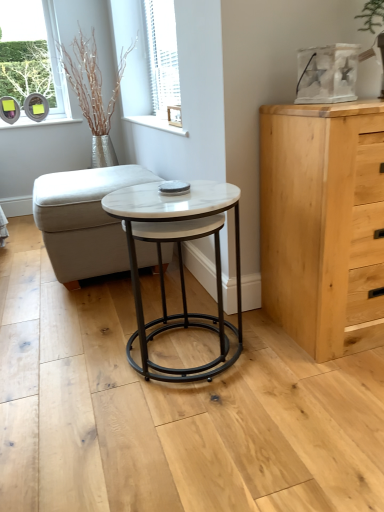
Where is `free space in front of light wood chest of drawers at right`? free space in front of light wood chest of drawers at right is located at coordinates (329, 402).